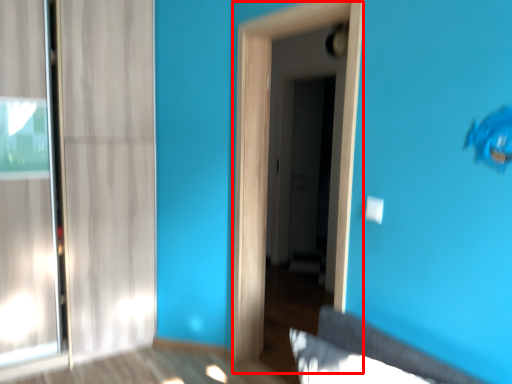
Question: From the image's perspective, where is screen door (annotated by the red box) located relative to screen door?

Choices:
 (A) above
 (B) below

Answer: (B)